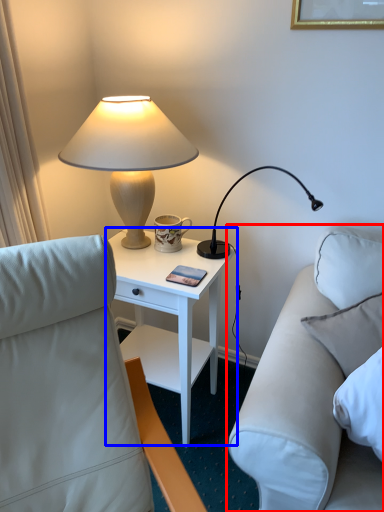
Question: Which of the following is the closest to the observer, studio couch (highlighted by a red box) or nightstand (highlighted by a blue box)?

Choices:
 (A) studio couch
 (B) nightstand

Answer: (A)